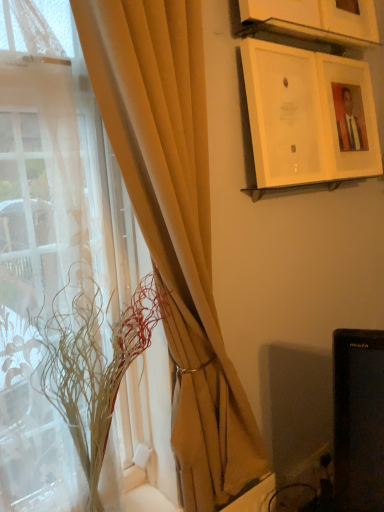
The width and height of the screenshot is (384, 512). What are the coordinates of `white glossy picture frame at upper right, the third picture frame positioned from the top` in the screenshot? It's located at (304, 115).

At what (x,y) coordinates should I click in order to perform the action: click on wooden picture frame at upper center, which is counted as the 3th picture frame, starting from the bottom. Please return your answer as a coordinate pair (x, y). This screenshot has height=512, width=384. Looking at the image, I should click on (350, 18).

The width and height of the screenshot is (384, 512). Find the location of `matte beige curtain at left`. matte beige curtain at left is located at coordinates (174, 222).

In order to face matte white picture frame at upper right, arranged as the second picture frame when viewed from the top, should I rotate leftwards or rightwards?

Rotate right and turn 20.412 degrees.

Image resolution: width=384 pixels, height=512 pixels. What do you see at coordinates (84, 362) in the screenshot?
I see `translucent glass vase at left` at bounding box center [84, 362].

Locate an element on the screen. This screenshot has width=384, height=512. translucent fabric at left is located at coordinates (56, 175).

From a real-world perspective, relative to translucent glass vase at left, is wooden picture frame at upper center, arranged as the 1th picture frame when viewed from the top, vertically above or below?

From a real-world perspective, wooden picture frame at upper center, arranged as the 1th picture frame when viewed from the top, is physically above translucent glass vase at left.

Is wooden picture frame at upper center, which is counted as the 3th picture frame, starting from the bottom, facing towards translucent glass vase at left?

No.

Does white glossy picture frame at upper right, acting as the first picture frame starting from the bottom, have a greater height compared to matte white picture frame at upper right, arranged as the second picture frame when viewed from the top?

No, white glossy picture frame at upper right, acting as the first picture frame starting from the bottom, is not taller than matte white picture frame at upper right, arranged as the second picture frame when viewed from the top.

Where is `picture frame below the matte white picture frame at upper right, acting as the second picture frame starting from the bottom (from the image's perspective)`? The height and width of the screenshot is (512, 384). picture frame below the matte white picture frame at upper right, acting as the second picture frame starting from the bottom (from the image's perspective) is located at coordinates 304,115.

Considering the relative sizes of white glossy picture frame at upper right, the third picture frame positioned from the top, and matte white picture frame at upper right, acting as the second picture frame starting from the bottom, in the image provided, is white glossy picture frame at upper right, the third picture frame positioned from the top, wider than matte white picture frame at upper right, acting as the second picture frame starting from the bottom,?

No.

Which is behind, white glossy picture frame at upper right, acting as the first picture frame starting from the bottom, or matte white picture frame at upper right, arranged as the second picture frame when viewed from the top?

Positioned behind is matte white picture frame at upper right, arranged as the second picture frame when viewed from the top.

Is white glossy picture frame at upper right, the third picture frame positioned from the top, with wooden picture frame at upper center, which is counted as the 3th picture frame, starting from the bottom?

white glossy picture frame at upper right, the third picture frame positioned from the top, and wooden picture frame at upper center, which is counted as the 3th picture frame, starting from the bottom, are not in contact.

Considering the positions of objects white glossy picture frame at upper right, acting as the first picture frame starting from the bottom, and wooden picture frame at upper center, arranged as the 1th picture frame when viewed from the top, in the image provided, who is in front, white glossy picture frame at upper right, acting as the first picture frame starting from the bottom, or wooden picture frame at upper center, arranged as the 1th picture frame when viewed from the top,?

white glossy picture frame at upper right, acting as the first picture frame starting from the bottom, is closer to the camera.

From a real-world perspective, is white glossy picture frame at upper right, acting as the first picture frame starting from the bottom, physically located above or below wooden picture frame at upper center, arranged as the 1th picture frame when viewed from the top?

Clearly, from a real-world perspective, white glossy picture frame at upper right, acting as the first picture frame starting from the bottom, is below wooden picture frame at upper center, arranged as the 1th picture frame when viewed from the top.

Considering the sizes of white glossy picture frame at upper right, acting as the first picture frame starting from the bottom, and matte beige curtain at left in the image, is white glossy picture frame at upper right, acting as the first picture frame starting from the bottom, wider or thinner than matte beige curtain at left?

Clearly, white glossy picture frame at upper right, acting as the first picture frame starting from the bottom, has less width compared to matte beige curtain at left.

Is the position of white glossy picture frame at upper right, acting as the first picture frame starting from the bottom, more distant than that of matte beige curtain at left?

Yes, the depth of white glossy picture frame at upper right, acting as the first picture frame starting from the bottom, is greater than that of matte beige curtain at left.

Locate an element on the screen. This screenshot has width=384, height=512. curtain in front of the white glossy picture frame at upper right, acting as the first picture frame starting from the bottom is located at coordinates (174, 222).

From the image's perspective, which one is positioned lower, white glossy picture frame at upper right, the third picture frame positioned from the top, or matte beige curtain at left?

matte beige curtain at left appears lower in the image.

Which object is closer to the camera, translucent glass vase at left or translucent fabric at left?

translucent fabric at left is in front.

Is translucent glass vase at left facing away from translucent fabric at left?

Yes, translucent glass vase at left is positioned with its back facing translucent fabric at left.

Considering the relative sizes of translucent glass vase at left and translucent fabric at left in the image provided, is translucent glass vase at left thinner than translucent fabric at left?

No.

Image resolution: width=384 pixels, height=512 pixels. In order to click on window in front of the translucent glass vase at left in this screenshot , I will do `click(56, 175)`.

Which of these two, wooden picture frame at upper center, which is counted as the 3th picture frame, starting from the bottom, or matte white picture frame at upper right, arranged as the second picture frame when viewed from the top, is smaller?

With smaller size is wooden picture frame at upper center, which is counted as the 3th picture frame, starting from the bottom.

The height and width of the screenshot is (512, 384). What are the coordinates of `picture frame that is the 1st one when counting forward from the matte white picture frame at upper right, arranged as the second picture frame when viewed from the top` in the screenshot? It's located at 350,18.

Can you confirm if wooden picture frame at upper center, which is counted as the 3th picture frame, starting from the bottom, is positioned to the left of matte white picture frame at upper right, acting as the second picture frame starting from the bottom?

Correct, you'll find wooden picture frame at upper center, which is counted as the 3th picture frame, starting from the bottom, to the left of matte white picture frame at upper right, acting as the second picture frame starting from the bottom.

Considering the relative positions of translucent glass vase at left and white glossy picture frame at upper right, acting as the first picture frame starting from the bottom, in the image provided, is translucent glass vase at left to the left of white glossy picture frame at upper right, acting as the first picture frame starting from the bottom, from the viewer's perspective?

Correct, you'll find translucent glass vase at left to the left of white glossy picture frame at upper right, acting as the first picture frame starting from the bottom.

Is translucent glass vase at left inside the boundaries of white glossy picture frame at upper right, acting as the first picture frame starting from the bottom, or outside?

The correct answer is: outside.

Can you confirm if translucent glass vase at left is bigger than white glossy picture frame at upper right, acting as the first picture frame starting from the bottom?

Indeed, translucent glass vase at left has a larger size compared to white glossy picture frame at upper right, acting as the first picture frame starting from the bottom.

Is translucent glass vase at left touching white glossy picture frame at upper right, acting as the first picture frame starting from the bottom?

translucent glass vase at left is not next to white glossy picture frame at upper right, acting as the first picture frame starting from the bottom, and they're not touching.

At what (x,y) coordinates should I click in order to perform the action: click on the 3rd picture frame above the translucent glass vase at left (from a real-world perspective). Please return your answer as a coordinate pair (x, y). Image resolution: width=384 pixels, height=512 pixels. Looking at the image, I should click on (350, 18).

Which picture frame is the 2nd one when counting from the back of the white glossy picture frame at upper right, acting as the first picture frame starting from the bottom? Please provide its 2D coordinates.

[(348, 117)]

When comparing their distances from matte beige curtain at left, does wooden picture frame at upper center, arranged as the 1th picture frame when viewed from the top, or matte white picture frame at upper right, acting as the second picture frame starting from the bottom, seem closer?

matte white picture frame at upper right, acting as the second picture frame starting from the bottom, is closer to matte beige curtain at left.

When comparing their distances from wooden picture frame at upper center, which is counted as the 3th picture frame, starting from the bottom, does matte beige curtain at left or matte white picture frame at upper right, acting as the second picture frame starting from the bottom, seem closer?

matte white picture frame at upper right, acting as the second picture frame starting from the bottom, is positioned closer to the anchor wooden picture frame at upper center, which is counted as the 3th picture frame, starting from the bottom.

Estimate the real-world distances between objects in this image. Which object is further from translucent glass vase at left, white glossy picture frame at upper right, acting as the first picture frame starting from the bottom, or matte white picture frame at upper right, arranged as the second picture frame when viewed from the top?

matte white picture frame at upper right, arranged as the second picture frame when viewed from the top, is further to translucent glass vase at left.

Estimate the real-world distances between objects in this image. Which object is further from translucent glass vase at left, white glossy picture frame at upper right, acting as the first picture frame starting from the bottom, or wooden picture frame at upper center, arranged as the 1th picture frame when viewed from the top?

wooden picture frame at upper center, arranged as the 1th picture frame when viewed from the top.

Estimate the real-world distances between objects in this image. Which object is closer to wooden picture frame at upper center, which is counted as the 3th picture frame, starting from the bottom, matte white picture frame at upper right, acting as the second picture frame starting from the bottom, or translucent fabric at left?

The object closer to wooden picture frame at upper center, which is counted as the 3th picture frame, starting from the bottom, is matte white picture frame at upper right, acting as the second picture frame starting from the bottom.

Estimate the real-world distances between objects in this image. Which object is further from matte beige curtain at left, translucent fabric at left or translucent glass vase at left?

translucent glass vase at left is further to matte beige curtain at left.

Which object lies further to the anchor point wooden picture frame at upper center, which is counted as the 3th picture frame, starting from the bottom, translucent fabric at left or matte white picture frame at upper right, acting as the second picture frame starting from the bottom?

translucent fabric at left.

Estimate the real-world distances between objects in this image. Which object is further from wooden picture frame at upper center, which is counted as the 3th picture frame, starting from the bottom, translucent glass vase at left or white glossy picture frame at upper right, the third picture frame positioned from the top?

Based on the image, translucent glass vase at left appears to be further to wooden picture frame at upper center, which is counted as the 3th picture frame, starting from the bottom.

This screenshot has height=512, width=384. What are the coordinates of `curtain between white glossy picture frame at upper right, acting as the first picture frame starting from the bottom, and translucent glass vase at left, in the vertical direction` in the screenshot? It's located at (174, 222).

Find the location of a particular element. Image resolution: width=384 pixels, height=512 pixels. picture frame situated between translucent fabric at left and wooden picture frame at upper center, arranged as the 1th picture frame when viewed from the top, from left to right is located at coordinates click(304, 115).

You are a GUI agent. You are given a task and a screenshot of the screen. Output one action in this format:
    pyautogui.click(x=<x>, y=<y>)
    Task: Click on the picture frame between matte white picture frame at upper right, acting as the second picture frame starting from the bottom, and translucent glass vase at left from top to bottom
    The image size is (384, 512).
    Given the screenshot: What is the action you would take?
    pyautogui.click(x=304, y=115)

Find the location of `curtain between wooden picture frame at upper center, which is counted as the 3th picture frame, starting from the bottom, and translucent fabric at left in the up-down direction`. curtain between wooden picture frame at upper center, which is counted as the 3th picture frame, starting from the bottom, and translucent fabric at left in the up-down direction is located at coordinates (174, 222).